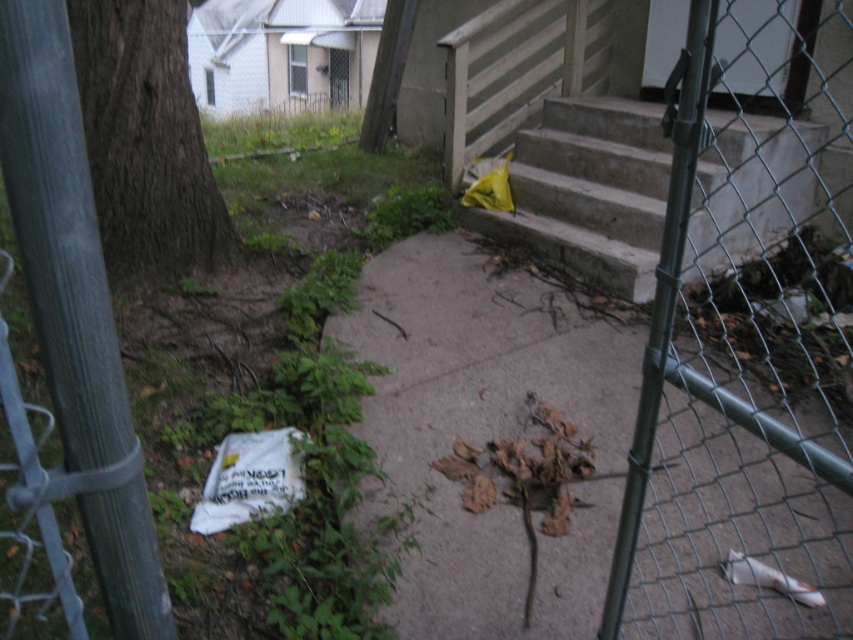
Who is taller, brown dirt pavement at center or concrete stairs at center?

Standing taller between the two is concrete stairs at center.

Where is `brown dirt pavement at center`? brown dirt pavement at center is located at coordinates click(490, 428).

This screenshot has width=853, height=640. In order to click on brown dirt pavement at center in this screenshot , I will do `click(490, 428)`.

Is concrete stairs at center to the left of brown rough bark tree at left from the viewer's perspective?

No, concrete stairs at center is not to the left of brown rough bark tree at left.

Who is more distant from viewer, (619, 99) or (209, 269)?

The point (619, 99) is more distant.

Identify the location of concrete stairs at center. The width and height of the screenshot is (853, 640). (589, 192).

Who is lower down, gray ribbed pole at left or brown rough bark tree at left?

gray ribbed pole at left

Which is more to the left, gray ribbed pole at left or brown rough bark tree at left?

brown rough bark tree at left

Does point (62, 122) come closer to viewer compared to point (91, 76)?

Yes.

At what (x,y) coordinates should I click in order to perform the action: click on gray ribbed pole at left. Please return your answer as a coordinate pair (x, y). This screenshot has width=853, height=640. Looking at the image, I should click on (59, 228).